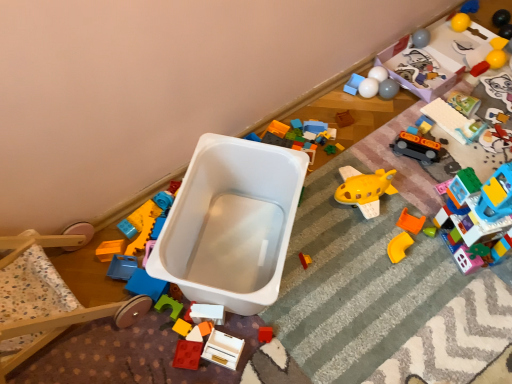
Where is `vacant space that's between matte yellow toy airplane at center, arranged as the 5th toy when viewed from the left, and orange matte plastic corner piece at lower right, the ninth toy positioned from the right`? Image resolution: width=512 pixels, height=384 pixels. vacant space that's between matte yellow toy airplane at center, arranged as the 5th toy when viewed from the left, and orange matte plastic corner piece at lower right, the ninth toy positioned from the right is located at coordinates (353, 255).